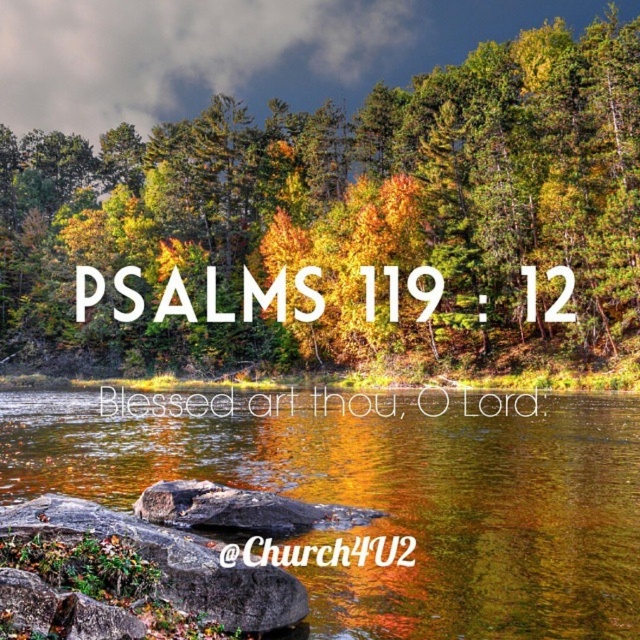
Is shiny reflective water at center further to the viewer compared to gray rough rock at center?

That is False.

The width and height of the screenshot is (640, 640). What do you see at coordinates (394, 500) in the screenshot?
I see `shiny reflective water at center` at bounding box center [394, 500].

Is point (212, 472) positioned behind point (294, 528)?

Yes, it is.

Find the location of `shiny reflective water at center`. shiny reflective water at center is located at coordinates (394, 500).

Does gray rough rock at lower left have a greater height compared to gray rough rock at center?

No, gray rough rock at lower left is not taller than gray rough rock at center.

Can you confirm if gray rough rock at lower left is wider than gray rough rock at center?

In fact, gray rough rock at lower left might be narrower than gray rough rock at center.

You are a GUI agent. You are given a task and a screenshot of the screen. Output one action in this format:
    pyautogui.click(x=<x>, y=<y>)
    Task: Click on the gray rough rock at lower left
    
    Given the screenshot: What is the action you would take?
    pyautogui.click(x=173, y=563)

What are the coordinates of `gray rough rock at lower left` in the screenshot? It's located at (173, 563).

Can you confirm if shiny reflective water at center is positioned above gray rough rock at lower left?

No, shiny reflective water at center is not above gray rough rock at lower left.

From the picture: Does shiny reflective water at center have a lesser width compared to gray rough rock at lower left?

In fact, shiny reflective water at center might be wider than gray rough rock at lower left.

The width and height of the screenshot is (640, 640). Describe the element at coordinates (394, 500) in the screenshot. I see `shiny reflective water at center` at that location.

This screenshot has width=640, height=640. What are the coordinates of `shiny reflective water at center` in the screenshot? It's located at (394, 500).